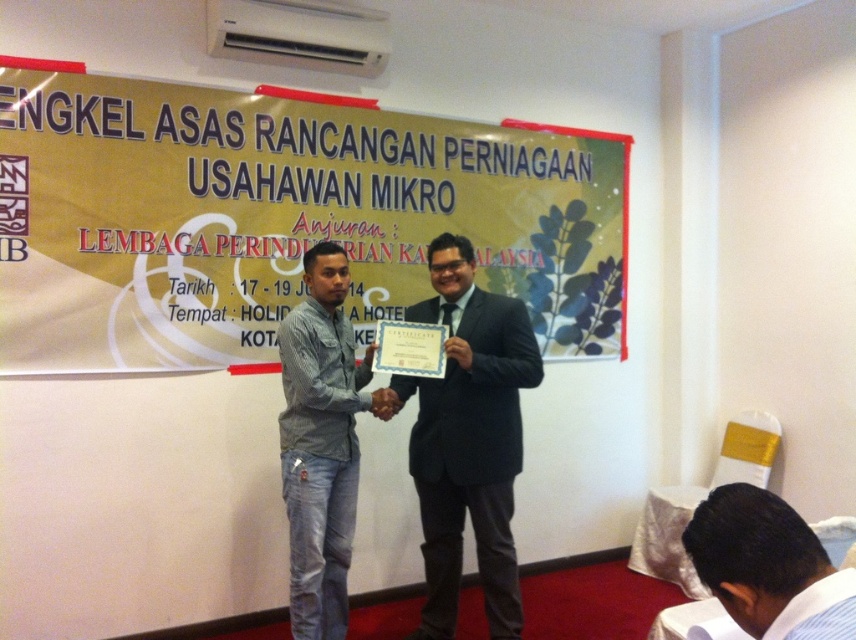
Locate an element on the screen. The image size is (856, 640). yellow paperboard at upper center is located at coordinates [278, 218].

Is yellow paperboard at upper center bigger than dark blue suit at center?

Yes.

Is point (578, 333) less distant than point (516, 584)?

No, (578, 333) is further to viewer.

The width and height of the screenshot is (856, 640). Identify the location of yellow paperboard at upper center. 278,218.

Which is in front, point (367, 236) or point (801, 563)?

Point (801, 563) is more forward.

Does yellow paperboard at upper center have a lesser height compared to white shirt at lower right?

No, yellow paperboard at upper center is not shorter than white shirt at lower right.

Is point (64, 330) positioned after point (730, 611)?

Yes.

This screenshot has height=640, width=856. I want to click on yellow paperboard at upper center, so click(x=278, y=218).

Is yellow paperboard at upper center taller than blue denim jeans at lower left?

No, yellow paperboard at upper center is not taller than blue denim jeans at lower left.

Between point (229, 209) and point (310, 422), which one is positioned behind?

The point (229, 209) is more distant.

Locate an element on the screen. The height and width of the screenshot is (640, 856). yellow paperboard at upper center is located at coordinates (278, 218).